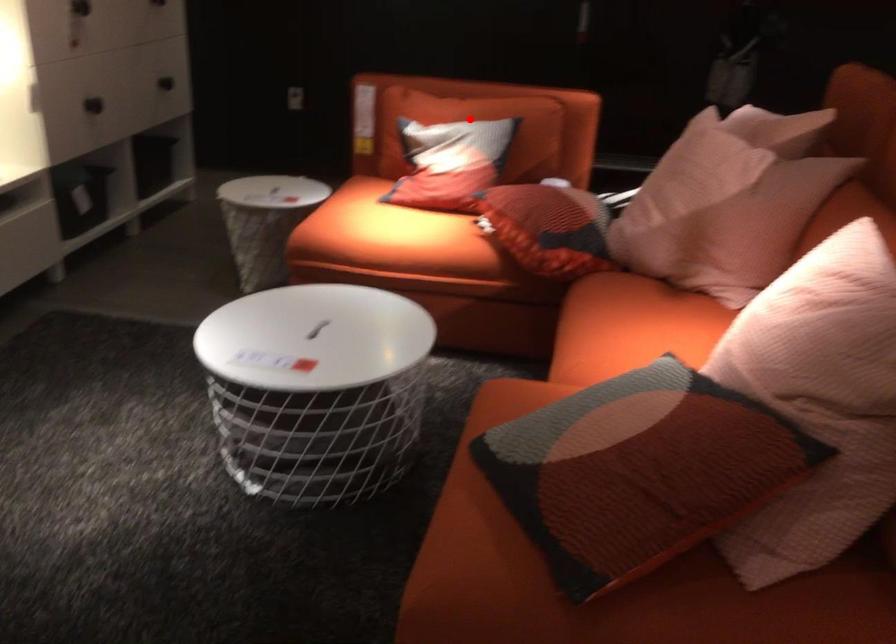
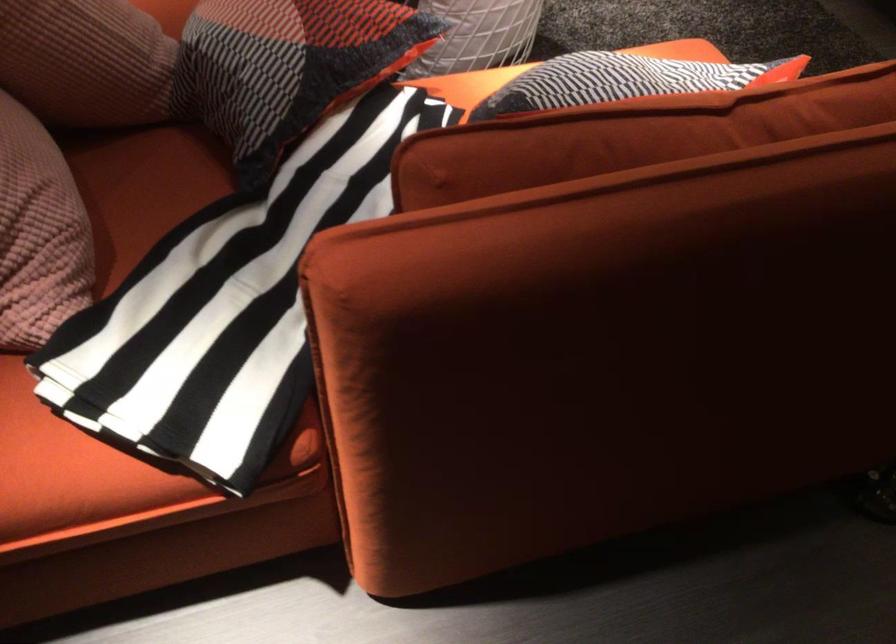
Question: I am providing you with two images of the same scene from different viewpoints. A red point is shown in image1. For the corresponding object point in image2, is it positioned nearer or farther from the camera?

Choices:
 (A) Nearer
 (B) Farther

Answer: (A)